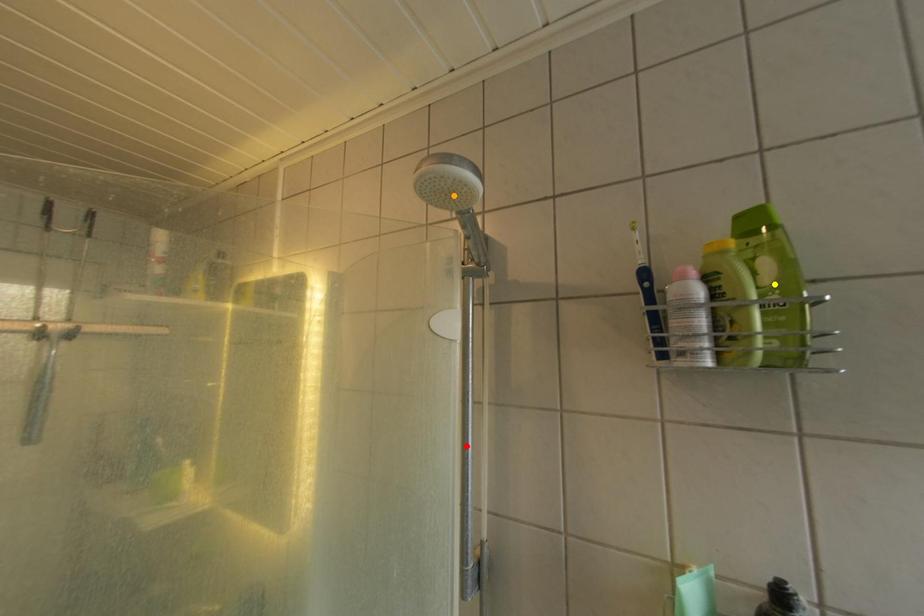
Order these from nearest to farthest:
A) red point
B) orange point
C) yellow point

1. yellow point
2. orange point
3. red point